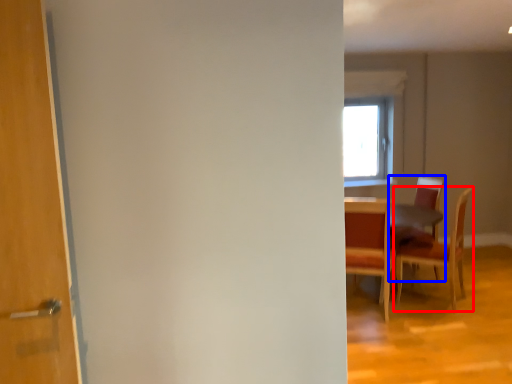
Question: Which point is further to the camera, chair (highlighted by a red box) or chair (highlighted by a blue box)?

Choices:
 (A) chair
 (B) chair

Answer: (B)